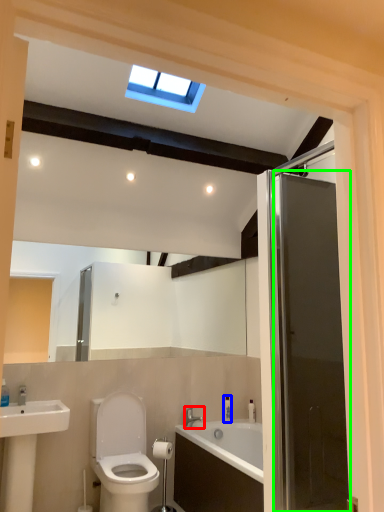
Question: Which object is the farthest from tap (highlighted by a red box)? Choose among these: toiletry (highlighted by a blue box) or door (highlighted by a green box).

Choices:
 (A) toiletry
 (B) door

Answer: (B)